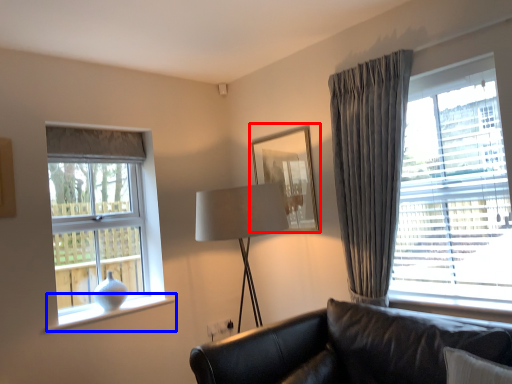
Question: Which point is closer to the camera, picture frame (highlighted by a red box) or window sill (highlighted by a blue box)?

Choices:
 (A) picture frame
 (B) window sill

Answer: (B)